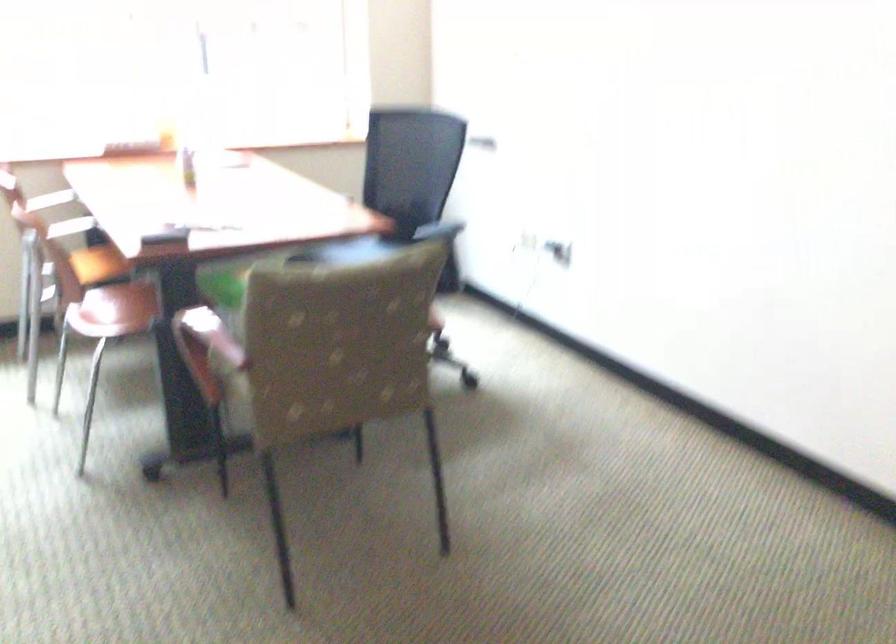
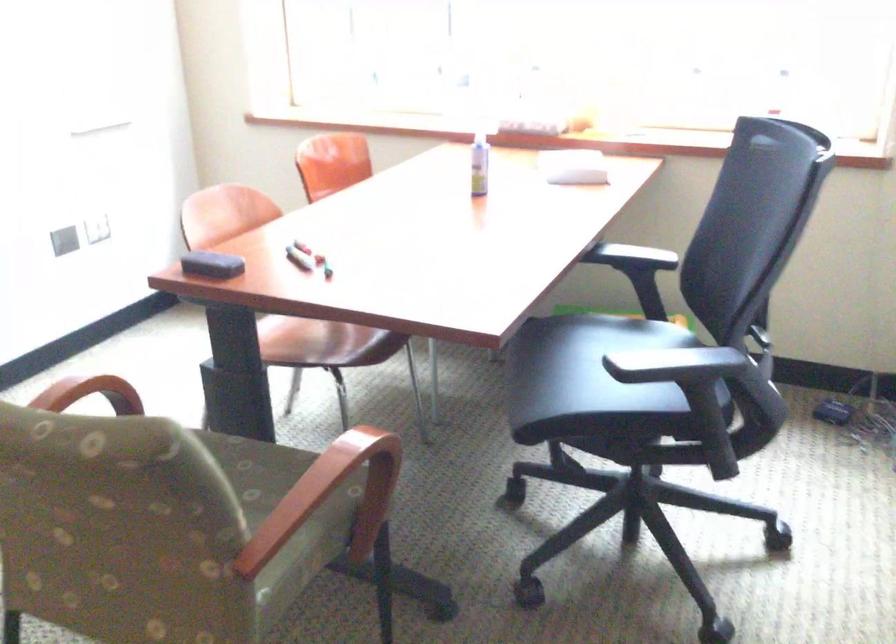
In the second image, find the point that corresponds to point (357, 254) in the first image.

(591, 361)